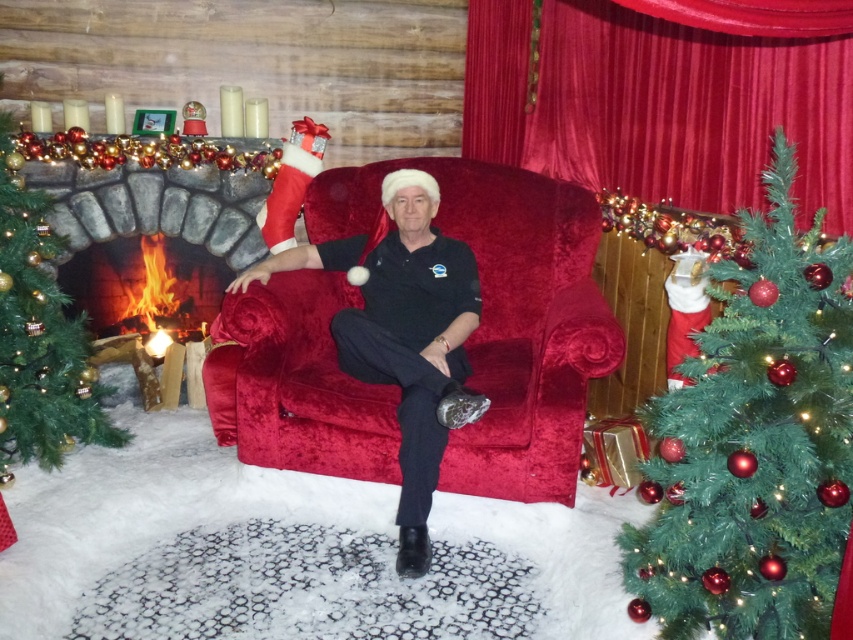
Question: Which point is farther from the camera taking this photo?

Choices:
 (A) click(695, 468)
 (B) click(405, 234)
 (C) click(439, 390)

Answer: (B)

Question: Among these objects, which one is farthest from the camera?

Choices:
 (A) stone fireplace at center
 (B) green textured christmas tree at center
 (C) velvet black shirt at center

Answer: (A)

Question: Is the position of velvet curtain at upper center more distant than that of green matte christmas tree at left?

Choices:
 (A) yes
 (B) no

Answer: (B)

Question: Can you confirm if green textured christmas tree at center is bigger than velvet curtain at upper center?

Choices:
 (A) yes
 (B) no

Answer: (B)

Question: Among these points, which one is nearest to the camera?

Choices:
 (A) (433, 369)
 (B) (784, 138)
 (C) (569, 161)

Answer: (B)

Question: Is velvet black shirt at center bigger than black velvet pants at center?

Choices:
 (A) no
 (B) yes

Answer: (B)